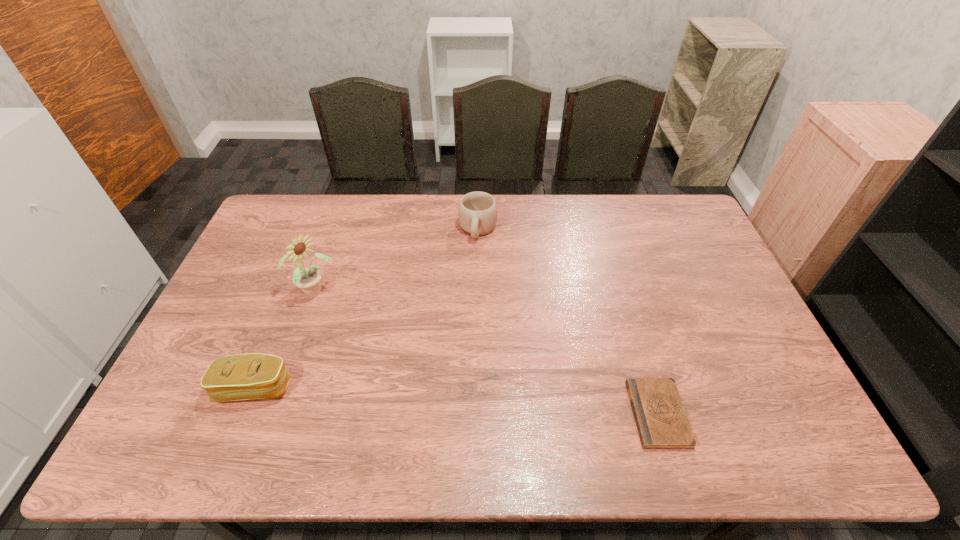
Identify the location of vacant position in the image that satisfies the following two spatial constraints: 1. on the front side of the rightmost object; 2. on the spine side of the farthest object. (477, 414).

The image size is (960, 540). I want to click on vacant space that satisfies the following two spatial constraints: 1. on the zipper side of the shortest object; 2. on the spine side of the clutch bag, so click(x=244, y=414).

At what (x,y) coordinates should I click in order to perform the action: click on free space that satisfies the following two spatial constraints: 1. on the zipper side of the rightmost object; 2. on the spine side of the clutch bag. Please return your answer as a coordinate pair (x, y). Image resolution: width=960 pixels, height=540 pixels. Looking at the image, I should click on (244, 414).

Where is `vacant region that satisfies the following two spatial constraints: 1. on the zipper side of the rightmost object; 2. on the spine side of the clutch bag`? vacant region that satisfies the following two spatial constraints: 1. on the zipper side of the rightmost object; 2. on the spine side of the clutch bag is located at coordinates (244, 414).

Locate an element on the screen. Image resolution: width=960 pixels, height=540 pixels. free spot that satisfies the following two spatial constraints: 1. on the front side of the shortest object; 2. on the spine side of the mug is located at coordinates (477, 414).

Find the location of `vacant space that satisfies the following two spatial constraints: 1. on the zipper side of the diary; 2. on the spine side of the clutch bag`. vacant space that satisfies the following two spatial constraints: 1. on the zipper side of the diary; 2. on the spine side of the clutch bag is located at coordinates (244, 414).